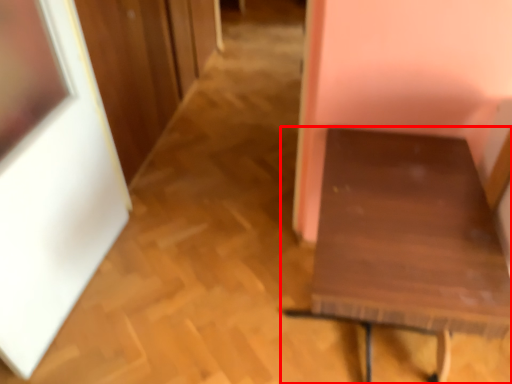
Question: Observing the image, what is the correct spatial positioning of furniture (annotated by the red box) in reference to picture frame?

Choices:
 (A) right
 (B) left

Answer: (A)